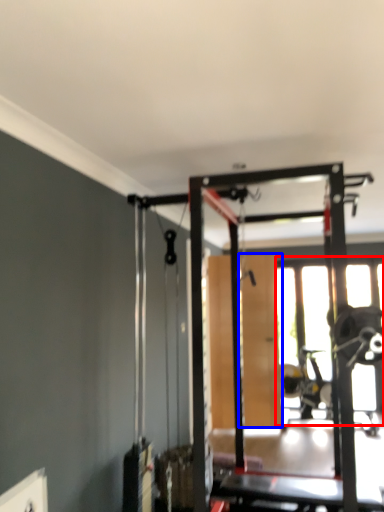
Question: Which of the following is the farthest to the observer, window (highlighted by a red box) or screen door (highlighted by a blue box)?

Choices:
 (A) window
 (B) screen door

Answer: (A)